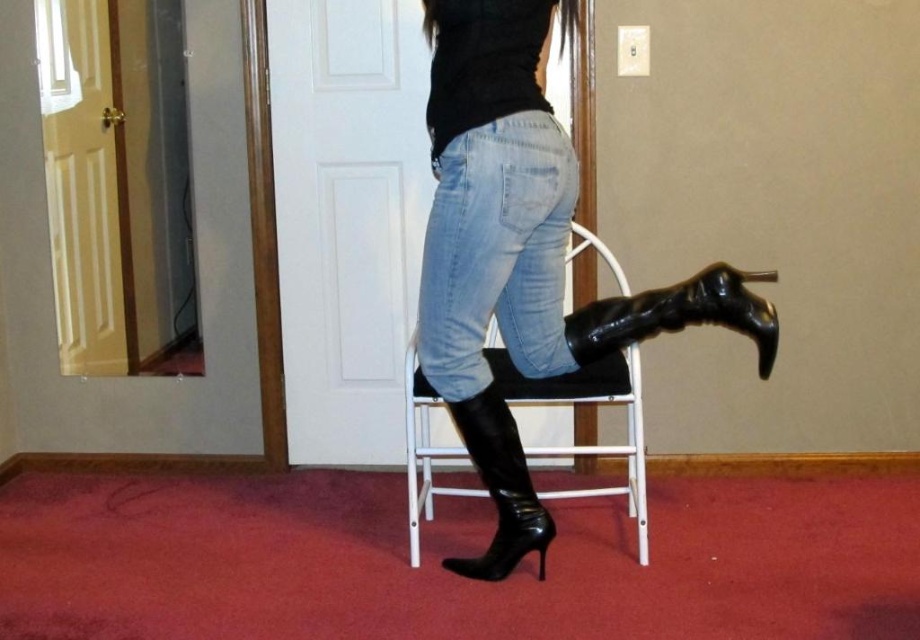
Does shiny black boots at center have a lesser height compared to shiny black boot at lower center?

Incorrect, shiny black boots at center's height does not fall short of shiny black boot at lower center's.

The width and height of the screenshot is (920, 640). Identify the location of shiny black boots at center. (523, 257).

Which is more to the right, black leather boot at lower right or shiny black boot at lower center?

From the viewer's perspective, black leather boot at lower right appears more on the right side.

Is point (627, 326) farther from camera compared to point (487, 564)?

No.

Locate an element on the screen. The height and width of the screenshot is (640, 920). black leather boot at lower right is located at coordinates (677, 314).

This screenshot has height=640, width=920. Describe the element at coordinates (523, 257) in the screenshot. I see `shiny black boots at center` at that location.

Between shiny black boots at center and light blue denim jeans at center, which one appears on the right side from the viewer's perspective?

shiny black boots at center is more to the right.

You are a GUI agent. You are given a task and a screenshot of the screen. Output one action in this format:
    pyautogui.click(x=<x>, y=<y>)
    Task: Click on the shiny black boots at center
    The width and height of the screenshot is (920, 640).
    Given the screenshot: What is the action you would take?
    pyautogui.click(x=523, y=257)

Where is `shiny black boots at center`? shiny black boots at center is located at coordinates (523, 257).